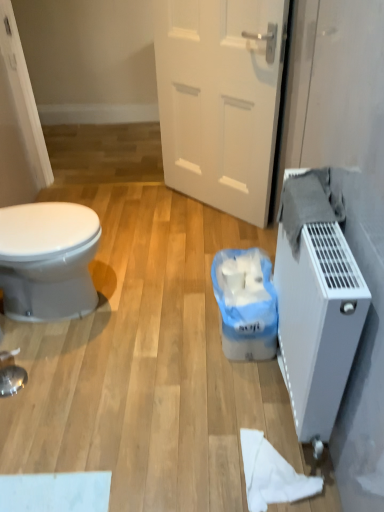
At what (x,y) coordinates should I click in order to perform the action: click on vacant space positioned to the left of white matte door at center. Please return your answer as a coordinate pair (x, y). This screenshot has width=384, height=512. Looking at the image, I should click on pyautogui.click(x=151, y=216).